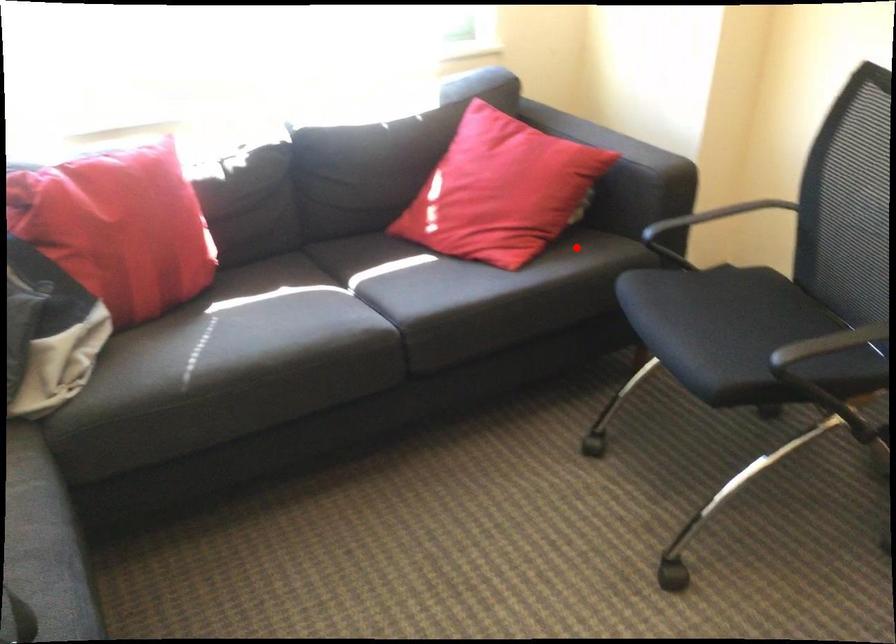
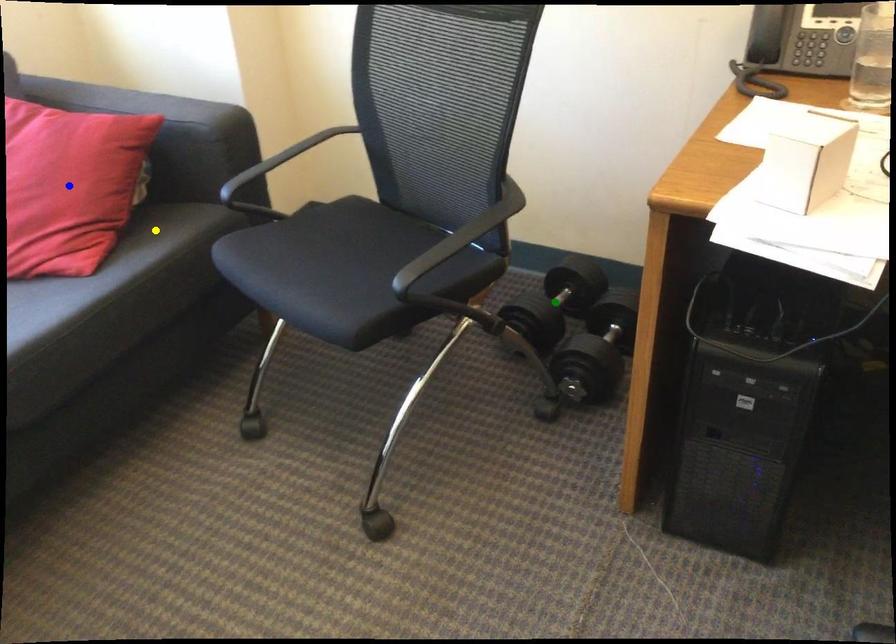
Question: I am providing you with two images of the same scene from different viewpoints. A red point is marked on the first image. You are given multiple points on the second image. In image 2, which mark is for the same physical point as the one in image 1?

Choices:
 (A) yellow point
 (B) green point
 (C) blue point

Answer: (A)